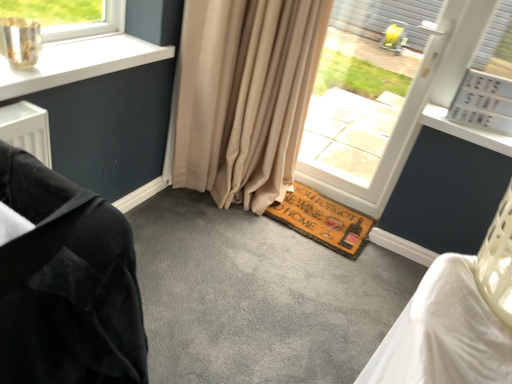
Question: Should I look upward or downward to see beige fabric curtain at center?

Choices:
 (A) up
 (B) down

Answer: (A)

Question: From a real-world perspective, is brown coir doormat at lower center positioned under beige fabric curtain at center based on gravity?

Choices:
 (A) no
 (B) yes

Answer: (B)

Question: Does brown coir doormat at lower center appear on the right side of beige fabric curtain at center?

Choices:
 (A) yes
 (B) no

Answer: (A)

Question: Is brown coir doormat at lower center thinner than beige fabric curtain at center?

Choices:
 (A) yes
 (B) no

Answer: (A)

Question: Does brown coir doormat at lower center lie in front of beige fabric curtain at center?

Choices:
 (A) no
 (B) yes

Answer: (A)

Question: From a real-world perspective, is brown coir doormat at lower center over beige fabric curtain at center?

Choices:
 (A) no
 (B) yes

Answer: (A)

Question: Does brown coir doormat at lower center come behind beige fabric curtain at center?

Choices:
 (A) no
 (B) yes

Answer: (B)

Question: Does beige fabric curtain at center turn towards brown coir doormat at lower center?

Choices:
 (A) no
 (B) yes

Answer: (A)

Question: Does beige fabric curtain at center touch brown coir doormat at lower center?

Choices:
 (A) yes
 (B) no

Answer: (B)

Question: Considering the relative positions of beige fabric curtain at center and brown coir doormat at lower center in the image provided, is beige fabric curtain at center in front of brown coir doormat at lower center?

Choices:
 (A) yes
 (B) no

Answer: (A)

Question: Is beige fabric curtain at center not within brown coir doormat at lower center?

Choices:
 (A) yes
 (B) no

Answer: (A)

Question: Is beige fabric curtain at center at the right side of brown coir doormat at lower center?

Choices:
 (A) yes
 (B) no

Answer: (B)

Question: From the image's perspective, would you say beige fabric curtain at center is positioned over brown coir doormat at lower center?

Choices:
 (A) yes
 (B) no

Answer: (A)

Question: Is white plastic window at center further to the viewer compared to beige fabric curtain at center?

Choices:
 (A) no
 (B) yes

Answer: (B)